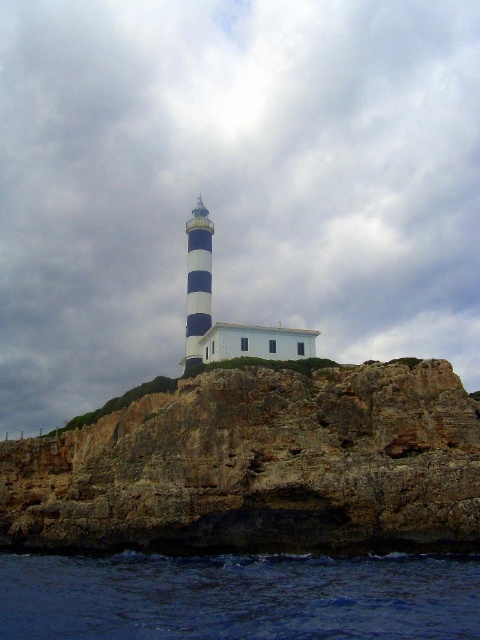
Question: Which of the following is the closest to the observer?

Choices:
 (A) dark blue water at lower left
 (B) blue and white striped lighthouse at center

Answer: (A)

Question: Which point is closer to the camera taking this photo?

Choices:
 (A) (211, 317)
 (B) (230, 580)
 (C) (182, 449)

Answer: (B)

Question: Can you confirm if rugged stone cliff at center is positioned to the right of blue and white striped lighthouse at center?

Choices:
 (A) yes
 (B) no

Answer: (A)

Question: Is rugged stone cliff at center above blue and white striped lighthouse at center?

Choices:
 (A) no
 (B) yes

Answer: (A)

Question: Can you confirm if rugged stone cliff at center is positioned to the left of blue and white striped lighthouse at center?

Choices:
 (A) yes
 (B) no

Answer: (B)

Question: Which object is the closest to the rugged stone cliff at center?

Choices:
 (A) dark blue water at lower left
 (B) blue and white striped lighthouse at center

Answer: (A)